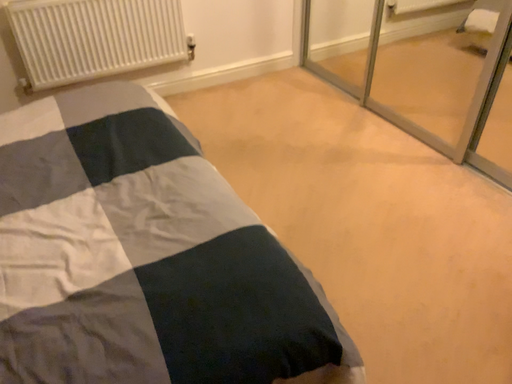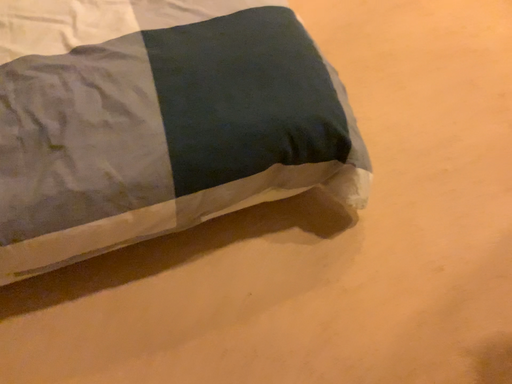
Question: Which way did the camera rotate in the video?

Choices:
 (A) rotated left
 (B) rotated right

Answer: (A)